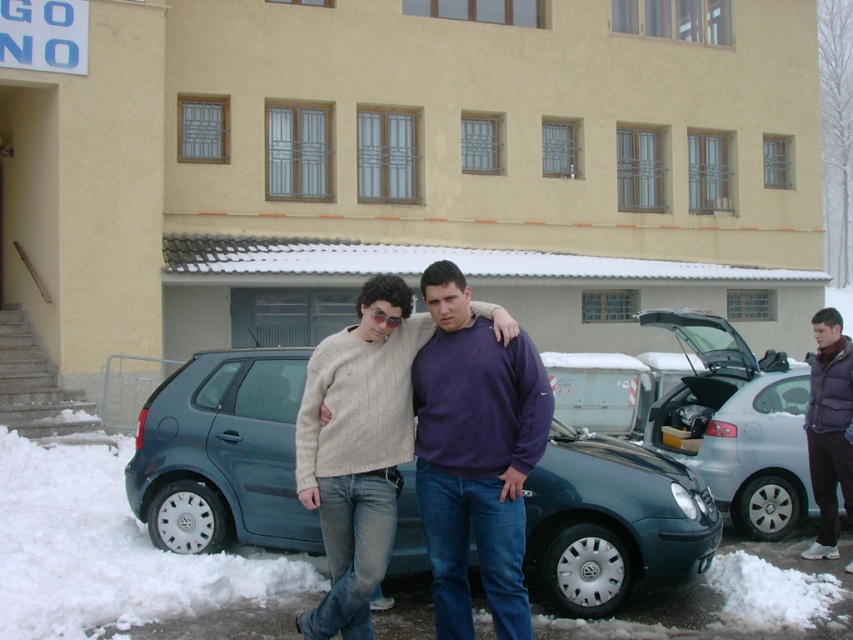
Question: Estimate the real-world distances between objects in this image. Which object is farther from the satin blue hatchback at center?

Choices:
 (A) purple fleece jacket at lower right
 (B) metallic silver hatchback at center
 (C) knitted sweater at center

Answer: (A)

Question: Considering the relative positions of satin blue hatchback at center and purple cotton sweatshirt at center in the image provided, where is satin blue hatchback at center located with respect to purple cotton sweatshirt at center?

Choices:
 (A) below
 (B) above

Answer: (A)

Question: Does purple cotton sweatshirt at center appear under purple fleece jacket at lower right?

Choices:
 (A) no
 (B) yes

Answer: (B)

Question: Which point is farther to the camera?

Choices:
 (A) (550, 429)
 (B) (772, 531)
 (C) (490, 524)
 (D) (819, 337)

Answer: (B)

Question: Is satin blue hatchback at center above purple fleece jacket at lower right?

Choices:
 (A) no
 (B) yes

Answer: (A)

Question: Which is nearer to the knitted sweater at center?

Choices:
 (A) purple cotton sweatshirt at center
 (B) purple fleece jacket at lower right
 (C) satin blue hatchback at center
 (D) metallic silver hatchback at center

Answer: (A)